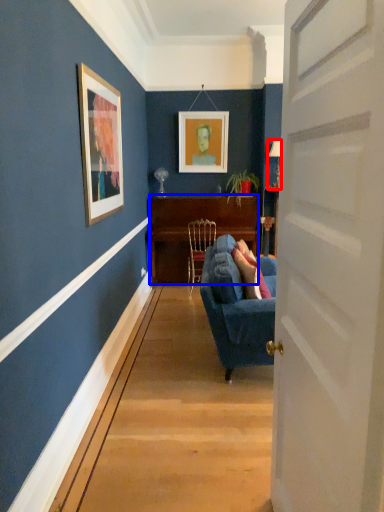
Question: Which of the following is the farthest to the observer, lamp (highlighted by a red box) or desk (highlighted by a blue box)?

Choices:
 (A) lamp
 (B) desk

Answer: (B)